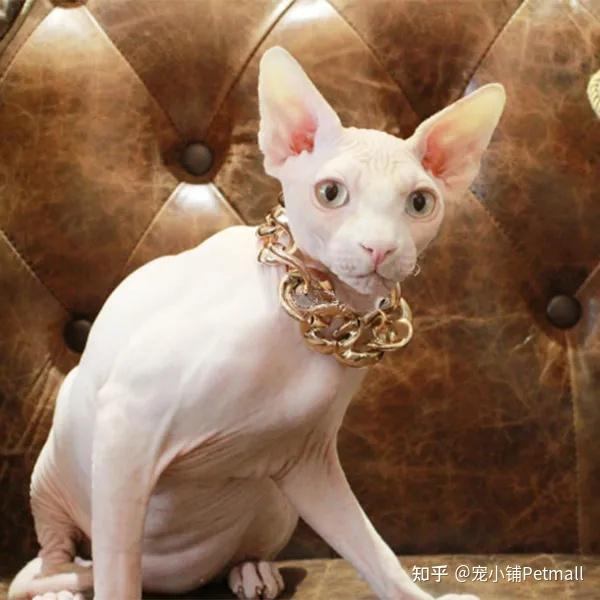
I want to click on seams in leather, so click(510, 232), click(234, 204), click(162, 207), click(30, 270), click(575, 431), click(593, 278).